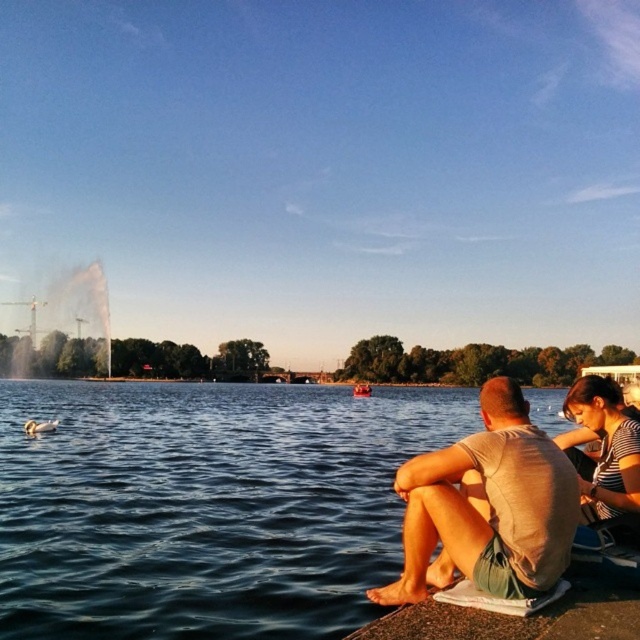
Question: Does blue water at lower left have a larger size compared to light gray cotton t-shirt at lower right?

Choices:
 (A) no
 (B) yes

Answer: (B)

Question: Can you confirm if blue water at lower left is wider than light gray cotton t-shirt at lower right?

Choices:
 (A) yes
 (B) no

Answer: (A)

Question: Which point appears closest to the camera in this image?

Choices:
 (A) (554, 467)
 (B) (472, 410)
 (C) (611, 417)
 (D) (358, 388)

Answer: (A)

Question: Which point is closer to the camera?

Choices:
 (A) light gray cotton t-shirt at lower right
 (B) striped shirt at lower right
 (C) blue water at lower left
 (D) wooden boat at center

Answer: (B)

Question: Estimate the real-world distances between objects in this image. Which object is closer to the wooden boat at center?

Choices:
 (A) light gray cotton t-shirt at lower right
 (B) striped shirt at lower right

Answer: (B)

Question: Does blue water at lower left appear on the left side of wooden boat at center?

Choices:
 (A) no
 (B) yes

Answer: (B)